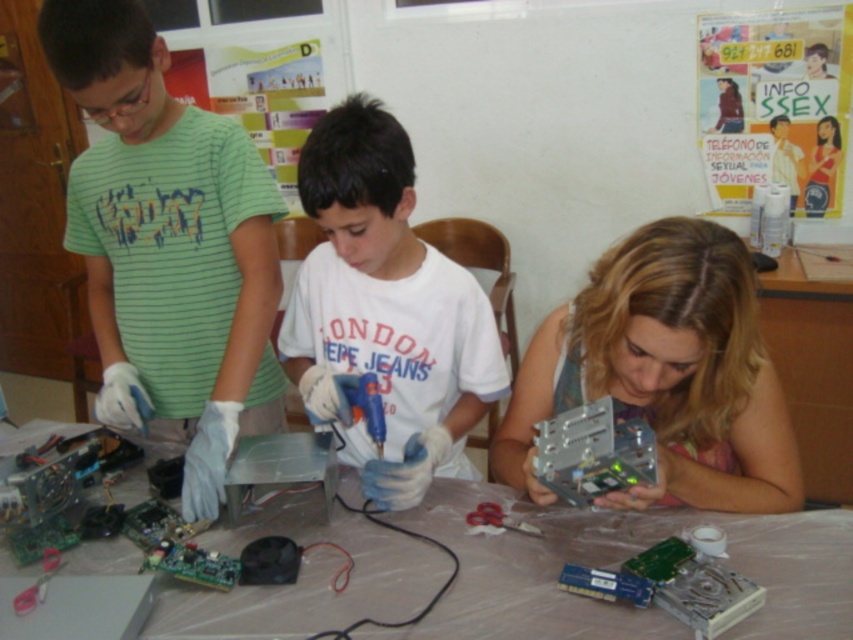
Question: Does green striped shirt at left lie in front of metallic gray electronic device at lower right?

Choices:
 (A) no
 (B) yes

Answer: (A)

Question: Which object appears closest to the camera in this image?

Choices:
 (A) clear plastic table at center
 (B) green striped shirt at left
 (C) metallic gray electronic device at lower right
 (D) metallic circuit board at lower right

Answer: (C)

Question: Which of these objects is positioned farthest from the clear plastic table at center?

Choices:
 (A) metallic circuit board at lower right
 (B) metallic gray electronic device at lower right
 (C) white matte glue gun at center

Answer: (C)

Question: Is white matte glue gun at center smaller than metallic circuit board at lower right?

Choices:
 (A) yes
 (B) no

Answer: (B)

Question: Among these points, which one is nearest to the camera?

Choices:
 (A) (535, 470)
 (B) (113, 557)
 (C) (714, 285)
 (D) (206, 156)

Answer: (C)

Question: Can you confirm if metallic gray electronic device at lower right is wider than white matte glue gun at center?

Choices:
 (A) yes
 (B) no

Answer: (A)